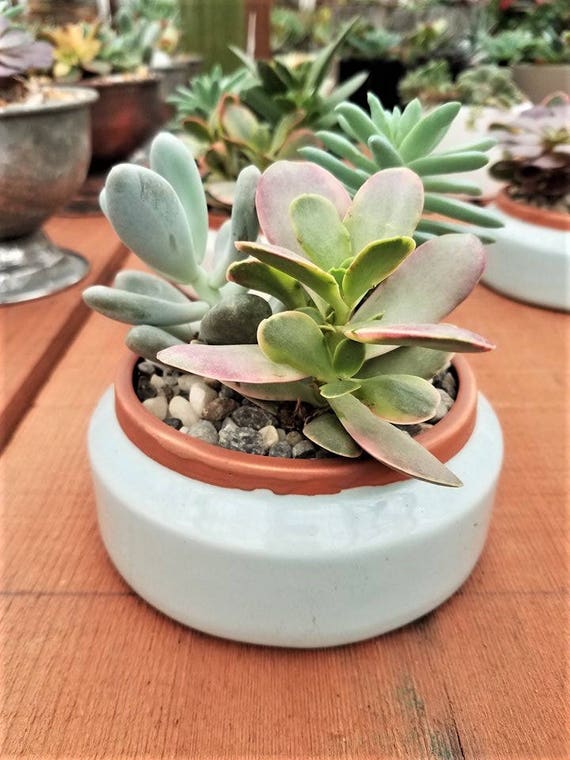
Locate an element on the screen. table is located at coordinates (227, 713).